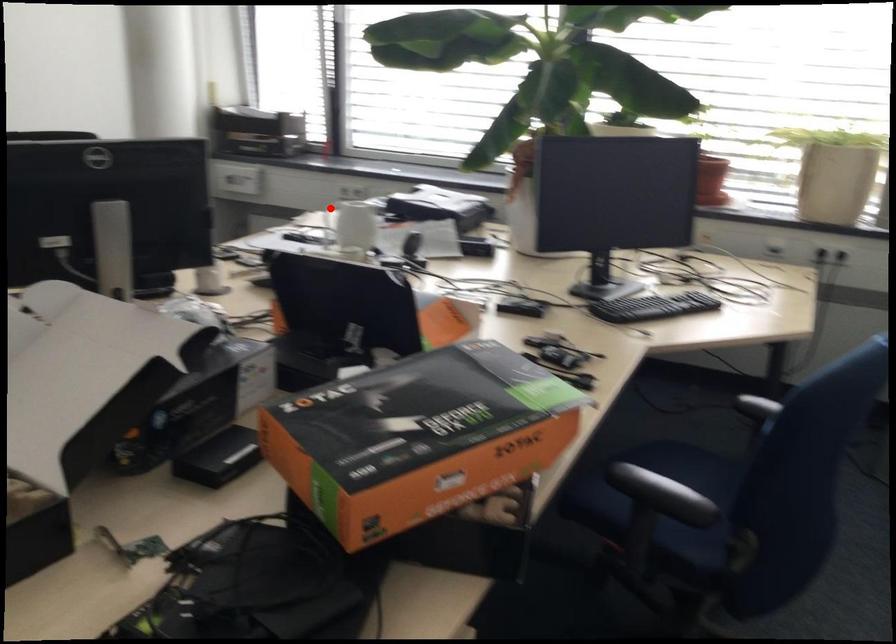
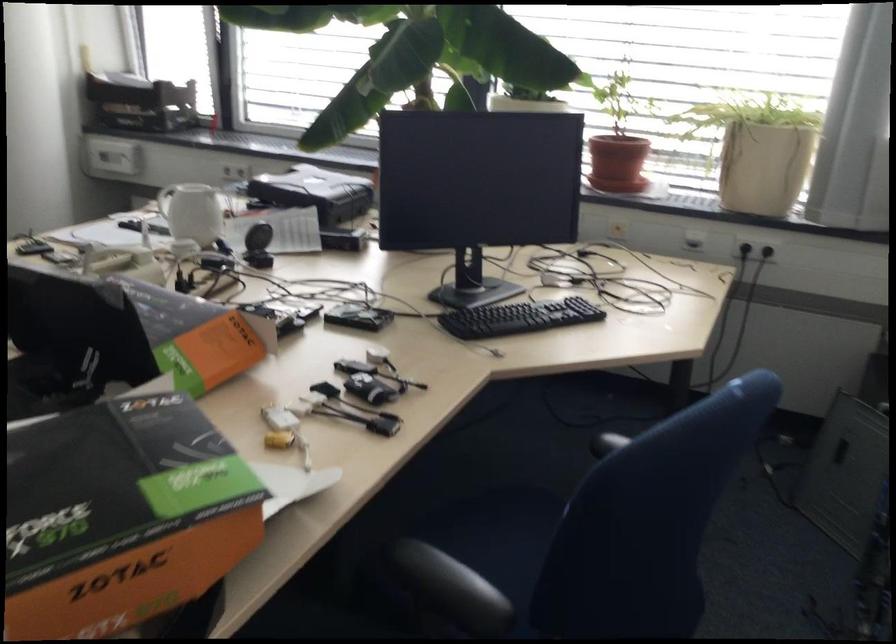
The point at the highlighted location is marked in the first image. Where is the corresponding point in the second image?

(165, 200)